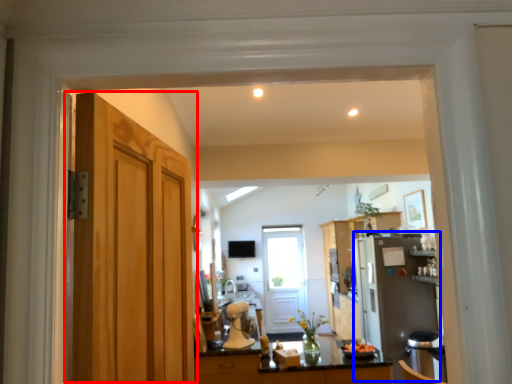
Question: Which object appears closest to the camera in this image, door (highlighted by a red box) or appliance (highlighted by a blue box)?

Choices:
 (A) door
 (B) appliance

Answer: (A)